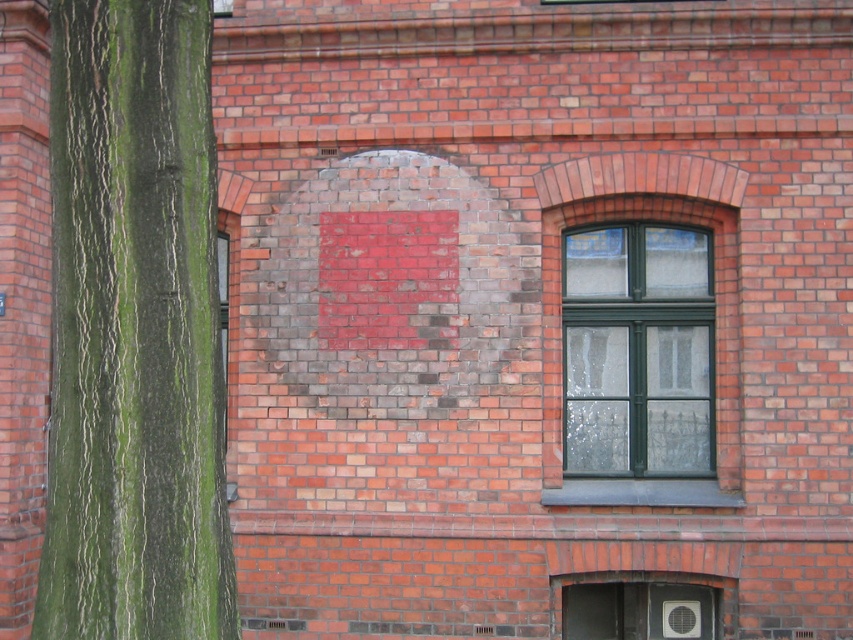
You are a painter standing in front of the brick building. You need to paint the green rough bark tree trunk at left and the green glass window at center. Which object requires a taller ladder to reach its top?

The green rough bark tree trunk at left is taller than the green glass window at center, so you need a taller ladder to reach the top of the green rough bark tree trunk at left.

You are a painter trying to decide where to place a new artwork. You have two options on the brick wall scene shown. The first option is next to the green rough bark tree trunk at left, and the second is next to the green glass window at center. Which location has a narrower space for your artwork?

The green rough bark tree trunk at left is thinner than the green glass window at center, so the space next to the green rough bark tree trunk at left is narrower and would be better for a smaller artwork.

You are standing in front of a brick building and see a point marked at coordinates [134,330]. According to the scene description, what object does this point correspond to?

The point at coordinates [134,330] corresponds to the green rough bark tree trunk at left.